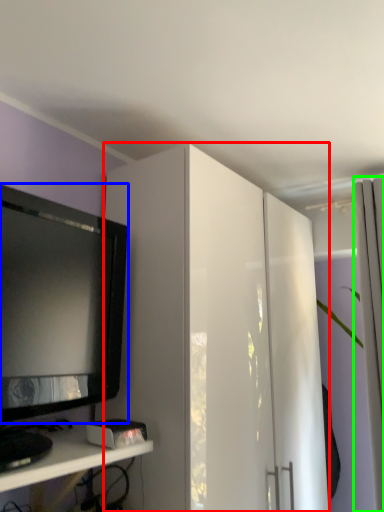
Question: Which object is positioned farthest from cabinetry (highlighted by a red box)? Select from television (highlighted by a blue box) and curtain (highlighted by a green box).

Choices:
 (A) television
 (B) curtain

Answer: (B)